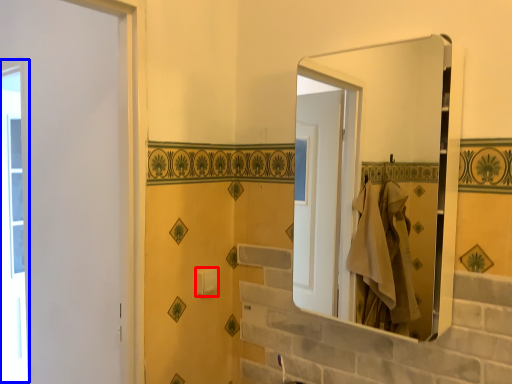
Question: Which point is further to the camera, towel bar (highlighted by a red box) or window (highlighted by a blue box)?

Choices:
 (A) towel bar
 (B) window

Answer: (B)